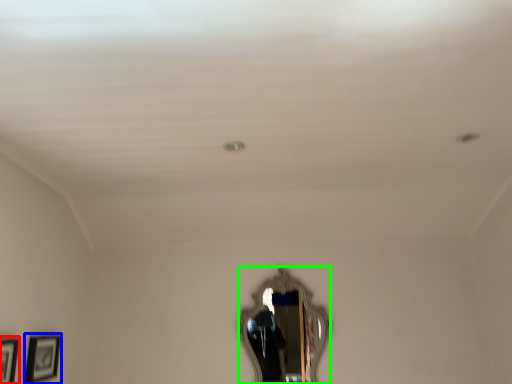
Question: Estimate the real-world distances between objects in this image. Which object is closer to picture frame (highlighted by a red box), picture frame (highlighted by a blue box) or mirror (highlighted by a green box)?

Choices:
 (A) picture frame
 (B) mirror

Answer: (A)